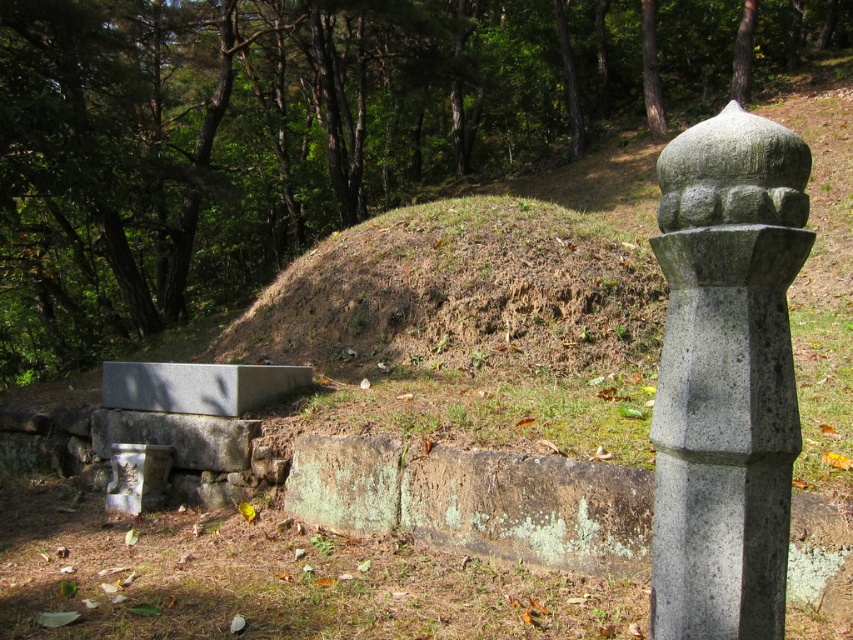
Which of these two, gray stone post at right or brown grassy mound at center, stands taller?

Standing taller between the two is brown grassy mound at center.

Is point (722, 536) farther from camera compared to point (370, 289)?

No.

Where is `gray stone post at right`? The image size is (853, 640). gray stone post at right is located at coordinates (726, 376).

What do you see at coordinates (459, 291) in the screenshot? The height and width of the screenshot is (640, 853). I see `brown grassy mound at center` at bounding box center [459, 291].

Does brown grassy mound at center appear over gray concrete bench at lower left?

Correct, brown grassy mound at center is located above gray concrete bench at lower left.

This screenshot has height=640, width=853. Find the location of `brown grassy mound at center`. brown grassy mound at center is located at coordinates (459, 291).

Who is higher up, gray stone post at right or gray concrete bench at lower left?

gray stone post at right is above.

This screenshot has width=853, height=640. Find the location of `gray stone post at right`. gray stone post at right is located at coordinates (726, 376).

Find the location of `gray stone post at right`. gray stone post at right is located at coordinates (726, 376).